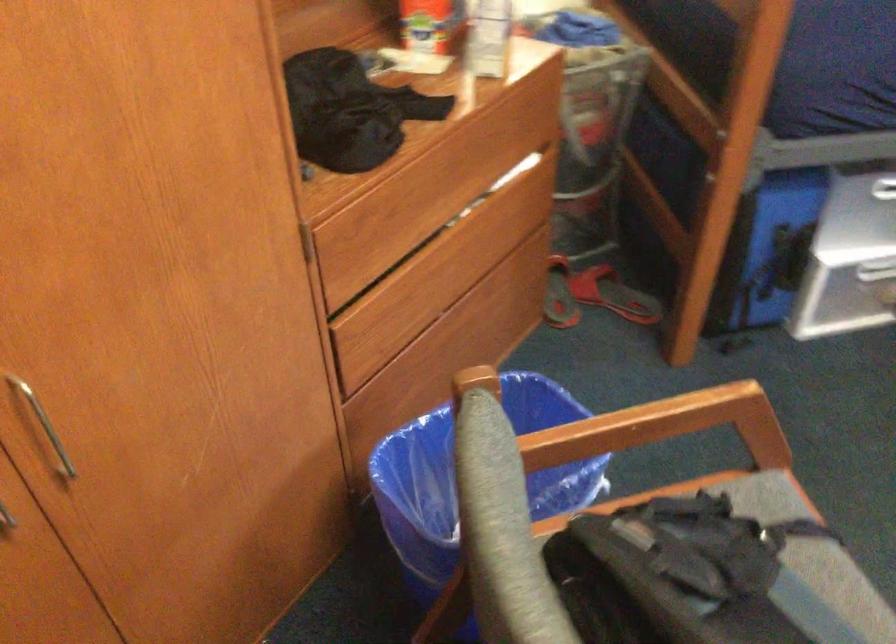
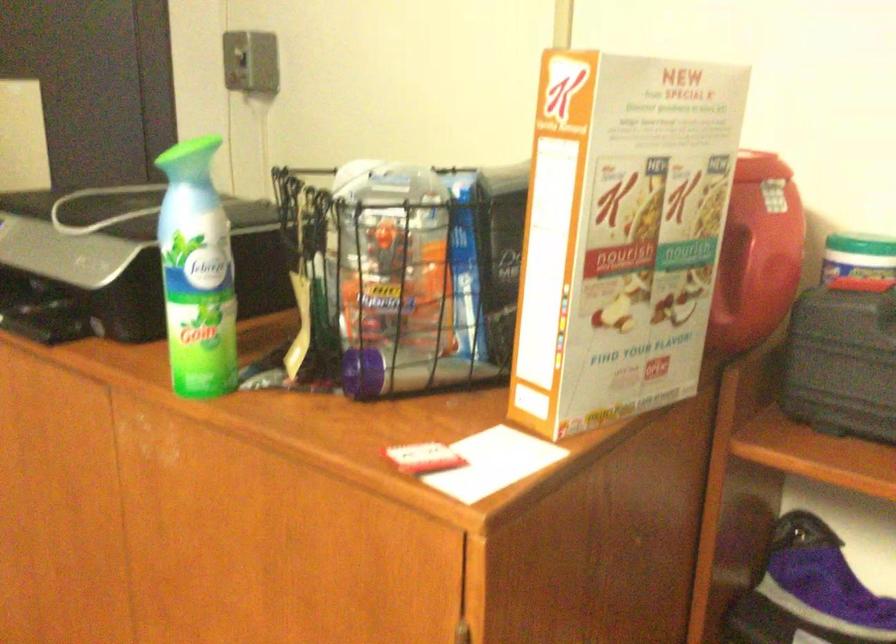
Question: The camera is either moving clockwise (left) or counter-clockwise (right) around the object. The first image is from the beginning of the video and the second image is from the end. Is the camera moving left or right when shooting the video?

Choices:
 (A) Left
 (B) Right

Answer: (B)